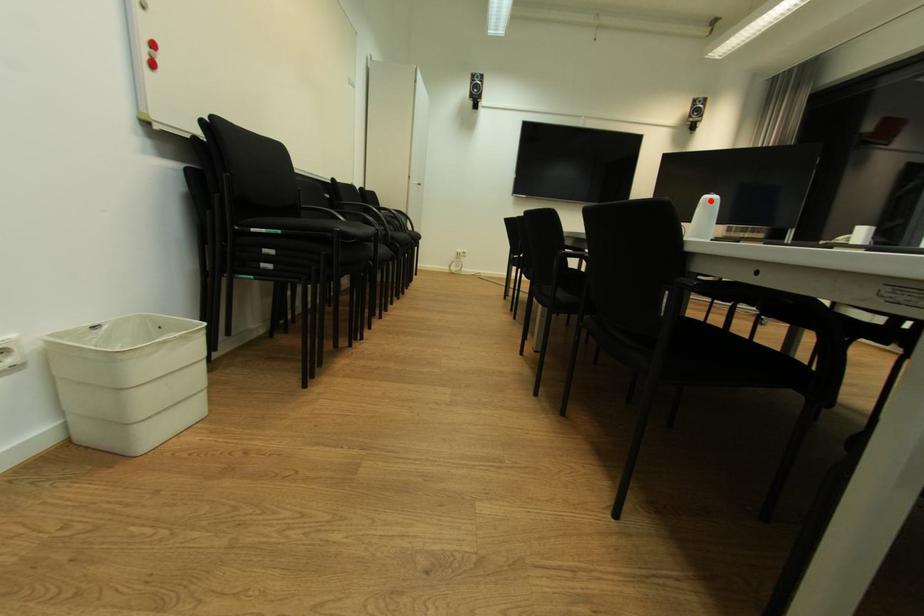
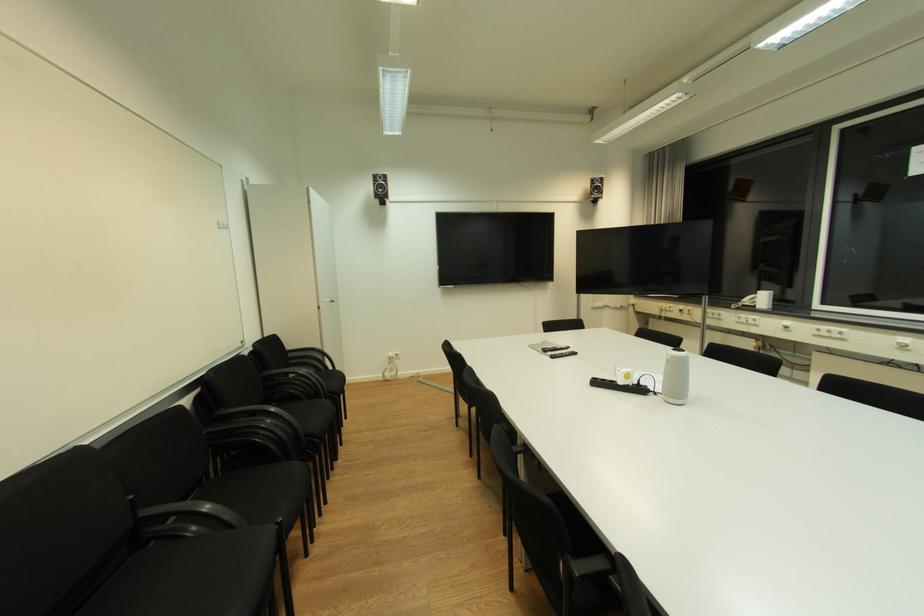
In the second image, find the point that corresponds to the highlighted location in the first image.

(678, 358)